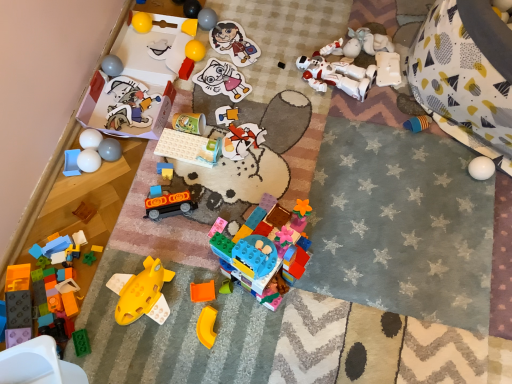
Find the location of a particular element. The width and height of the screenshot is (512, 384). vacant space in between white matte robot at center, marked as the third toy in a right-to-left arrangement, and yellow matte plastic piece at center, the seventeenth toy viewed from the left is located at coordinates (292, 162).